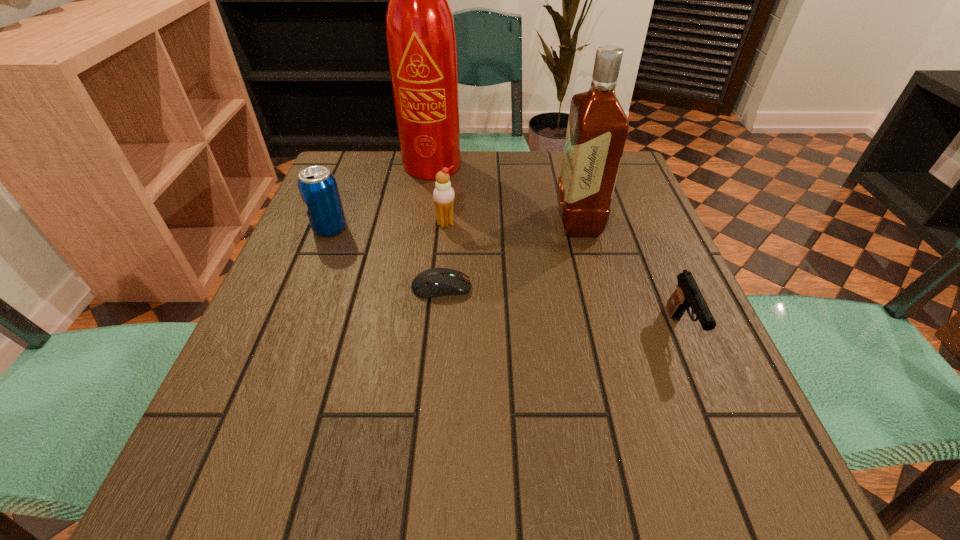
This screenshot has height=540, width=960. I want to click on liquor positioned at the right edge, so click(x=597, y=128).

Identify the location of pistol present at the right edge. (687, 294).

In the image, there is a desktop. Where is `blank space at the far edge`? The image size is (960, 540). blank space at the far edge is located at coordinates (513, 194).

Find the location of a particular element. vacant space at the near edge of the desktop is located at coordinates (344, 515).

Where is `vacant space at the left edge`? This screenshot has height=540, width=960. vacant space at the left edge is located at coordinates (347, 207).

The width and height of the screenshot is (960, 540). In the image, there is a desktop. What are the coordinates of `vacant space at the right edge` in the screenshot? It's located at (640, 302).

The width and height of the screenshot is (960, 540). In the image, there is a desktop. Identify the location of free space at the far left corner. (369, 181).

Where is `empty location between the computer equipment and the pop soda`? empty location between the computer equipment and the pop soda is located at coordinates (386, 258).

This screenshot has width=960, height=540. Identify the location of free space between the icecream and the nearest object. (564, 276).

Where is `free space between the second nearest object and the second tallest object`? This screenshot has height=540, width=960. free space between the second nearest object and the second tallest object is located at coordinates (510, 254).